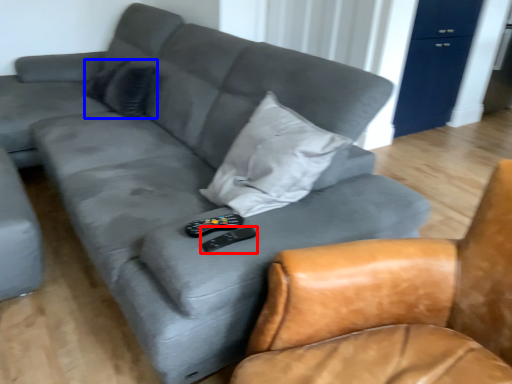
Question: Among these objects, which one is farthest to the camera, remote (highlighted by a red box) or pillow (highlighted by a blue box)?

Choices:
 (A) remote
 (B) pillow

Answer: (B)